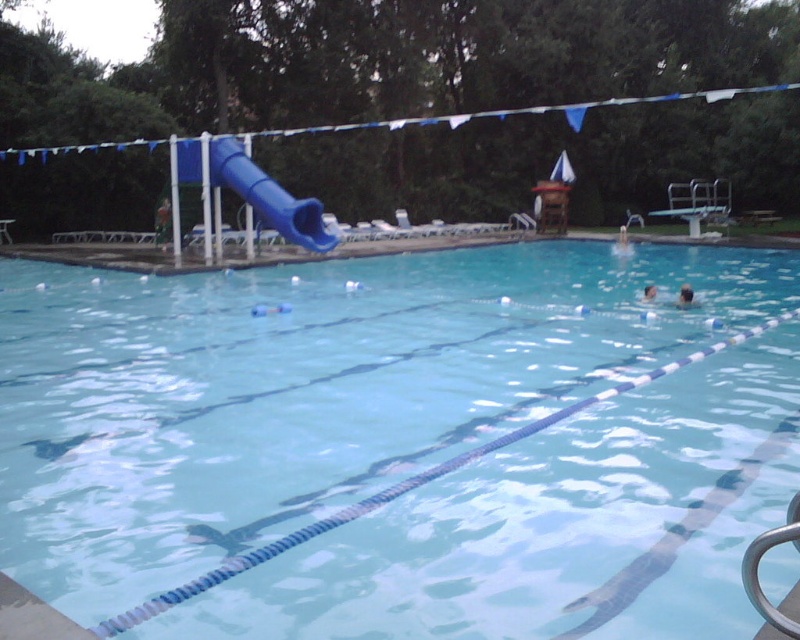
Question: Is blue plastic slide at left below white matte person at upper center?

Choices:
 (A) yes
 (B) no

Answer: (B)

Question: Which object is positioned farthest from the blue plastic slide at left?

Choices:
 (A) smooth skin head at right
 (B) white matte person at upper center

Answer: (B)

Question: Which object is farther from the camera taking this photo?

Choices:
 (A) blue plastic slide at left
 (B) smooth skin head at upper right
 (C) smooth skin head at right
 (D) white matte person at upper center

Answer: (D)

Question: Does blue plastic slide at left appear on the right side of white matte person at upper center?

Choices:
 (A) yes
 (B) no

Answer: (B)

Question: Which point is closer to the camera taking this photo?

Choices:
 (A) (692, 289)
 (B) (332, 500)
 (C) (644, 301)

Answer: (B)

Question: Is blue plastic slide at left to the right of white matte person at upper center from the viewer's perspective?

Choices:
 (A) no
 (B) yes

Answer: (A)